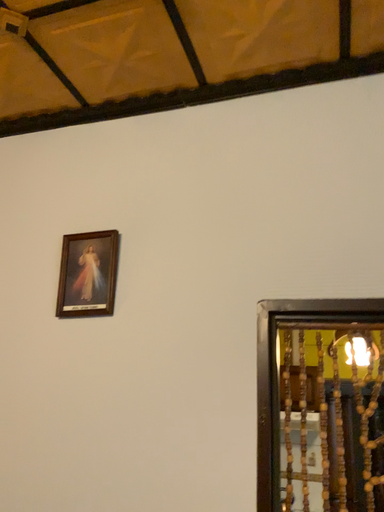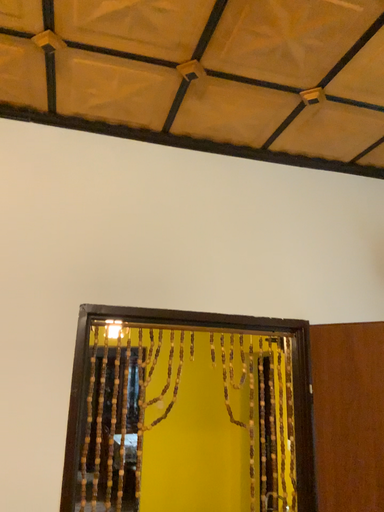
Question: Which way did the camera rotate in the video?

Choices:
 (A) rotated right
 (B) rotated left

Answer: (A)